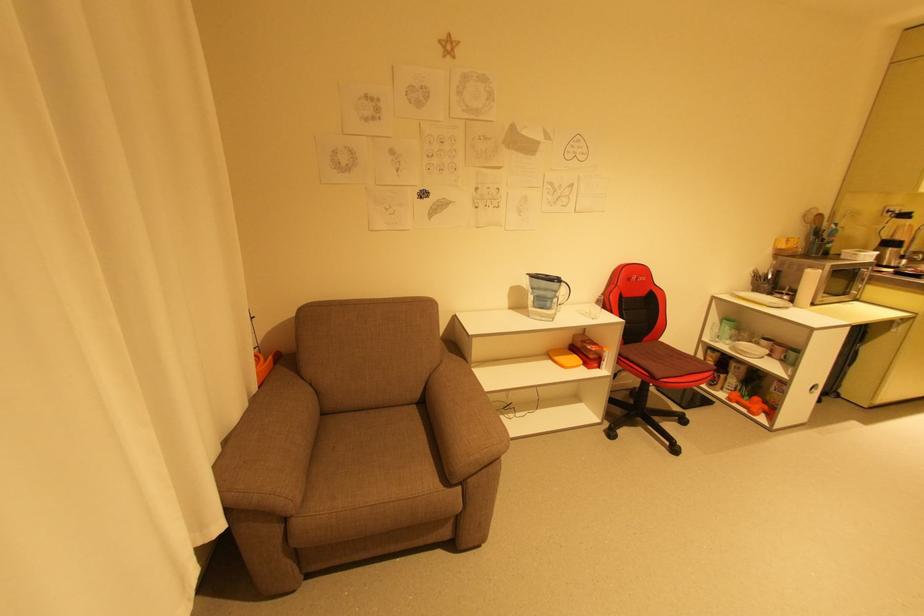
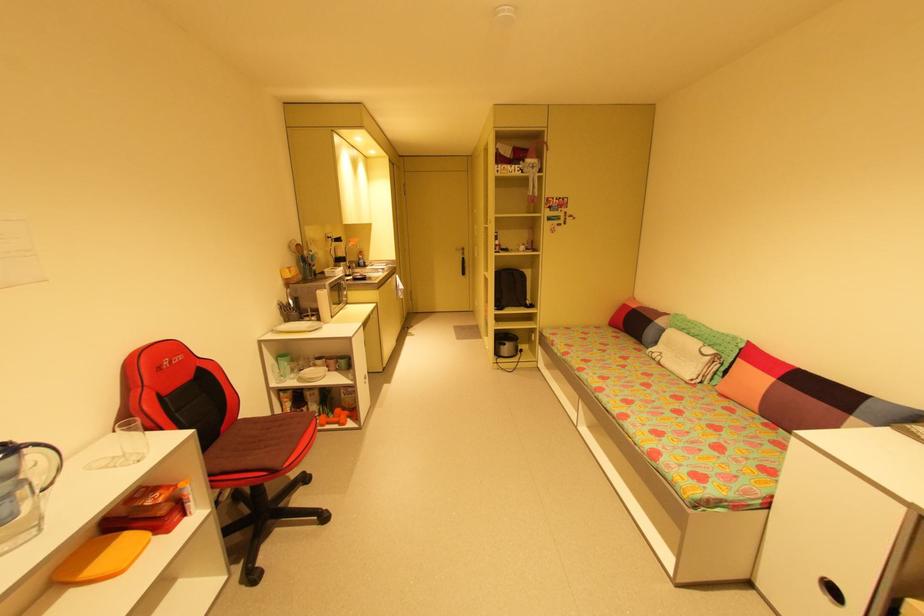
Locate, in the second image, the point that corresponds to pixel 733 328 in the first image.

(290, 363)